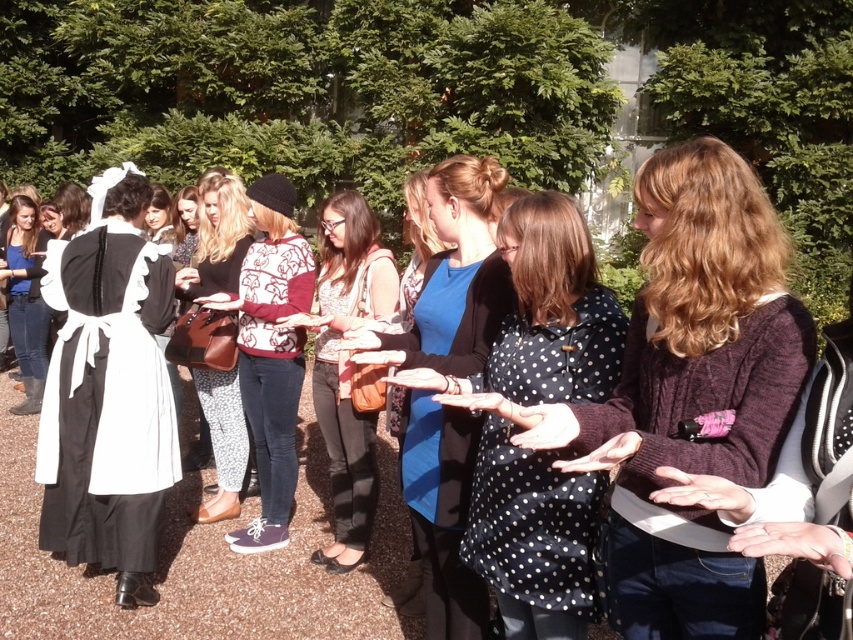
Can you confirm if dark brown sweater at center is positioned below floral-patterned leggings at center?

Yes, dark brown sweater at center is below floral-patterned leggings at center.

This screenshot has width=853, height=640. I want to click on dark brown sweater at center, so click(692, 392).

Is black satin dress at left positioned before white cotton apron at left?

Yes.

Is black satin dress at left taller than white cotton apron at left?

Indeed, black satin dress at left has a greater height compared to white cotton apron at left.

Is point (132, 340) behind point (26, 332)?

No, (132, 340) is in front of (26, 332).

The image size is (853, 640). Identify the location of black satin dress at left. (108, 392).

Is black satin dress at left bigger than white cotton dress at center?

No, black satin dress at left is not bigger than white cotton dress at center.

Is black satin dress at left in front of white cotton dress at center?

No, it is behind white cotton dress at center.

Which is behind, point (149, 189) or point (361, 257)?

The point (361, 257) is more distant.

Where is `black satin dress at left`? The image size is (853, 640). black satin dress at left is located at coordinates (108, 392).